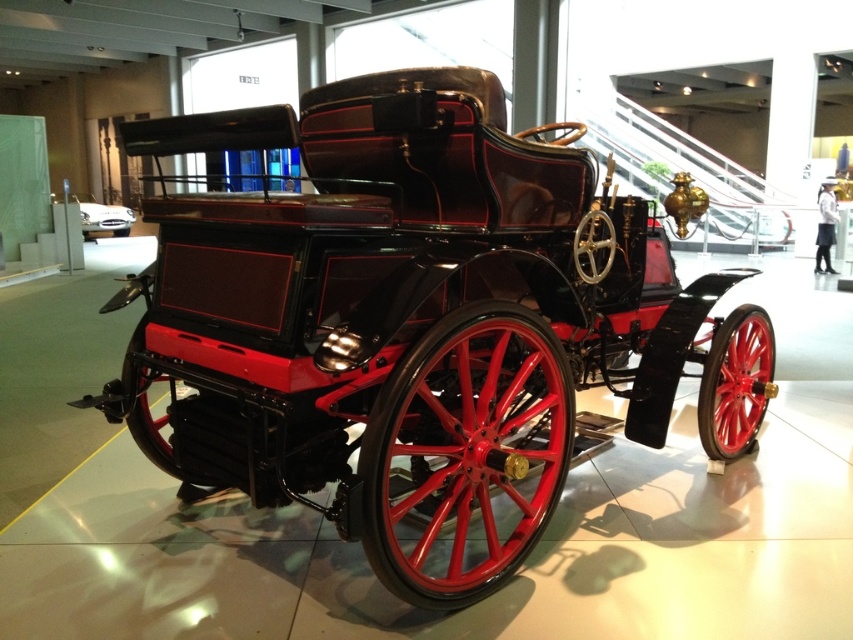
You are an art curator planning to move a large sculpture into the exhibition space. You need to decide whether to place it between the shiny black car at center and the polished wood coach at center. Based on their positions, which object is closer to you, and can the sculpture fit in the space between them?

The shiny black car at center is closer to you than the polished wood coach at center. However, the description does not provide the exact distance between them, so it is unclear if the sculpture can fit in the space between them.

You are a tour guide leading visitors through the museum. You want to point out the shiny black car at center and the polished wood coach at center to your group. Which one is positioned to the left of the other?

The shiny black car at center is to the left of the polished wood coach at center.